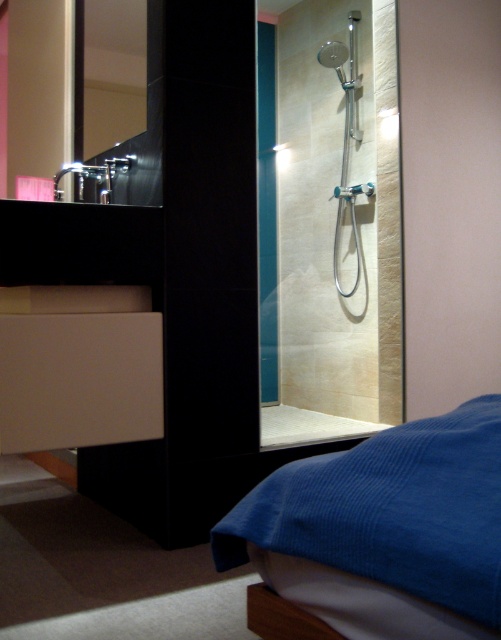
You are designing a bathroom layout and need to ensure that the polished silver mirror at upper left and the matte silver showerhead at upper center are spaced appropriately. Based on their sizes, which object requires more horizontal space in the bathroom?

The polished silver mirror at upper left requires more horizontal space because its width surpasses that of the matte silver showerhead at upper center.

You are standing in the bathroom and need to reach the blue corduroy bed at lower right. Based on its 2D coordinates, can you estimate how far it is from the center of the bathroom?

The blue corduroy bed at lower right is located at coordinates 0.830 on the x axis and 0.768 on the y axis. Since the center of the bathroom would be at coordinates (x=250, y=320), the bed is positioned to the lower right of the center, approximately 0.33 units away along the x axis and 0.268 units along the y axis. This places it relatively close to the right edge of the bathroom.